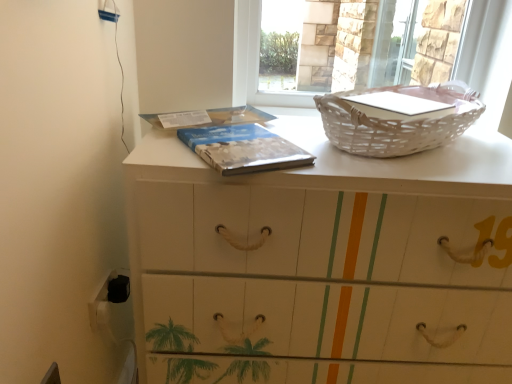
Question: Considering the relative sizes of white wicker basket at upper right and blue textured book at center in the image provided, is white wicker basket at upper right wider than blue textured book at center?

Choices:
 (A) no
 (B) yes

Answer: (A)

Question: From a real-world perspective, is white wicker basket at upper right beneath blue textured book at center?

Choices:
 (A) yes
 (B) no

Answer: (B)

Question: Is white wicker basket at upper right at the right side of blue textured book at center?

Choices:
 (A) yes
 (B) no

Answer: (A)

Question: Is white wicker basket at upper right shorter than blue textured book at center?

Choices:
 (A) yes
 (B) no

Answer: (B)

Question: Is white wicker basket at upper right bigger than blue textured book at center?

Choices:
 (A) yes
 (B) no

Answer: (A)

Question: Considering the relative positions of white wicker basket at upper right and blue textured book at center in the image provided, is white wicker basket at upper right to the left of blue textured book at center from the viewer's perspective?

Choices:
 (A) no
 (B) yes

Answer: (A)

Question: Considering the relative sizes of white wicker basket at upper right and white wicker basket at upper right in the image provided, is white wicker basket at upper right taller than white wicker basket at upper right?

Choices:
 (A) yes
 (B) no

Answer: (A)

Question: Considering the relative sizes of white wicker basket at upper right and white wicker basket at upper right in the image provided, is white wicker basket at upper right smaller than white wicker basket at upper right?

Choices:
 (A) yes
 (B) no

Answer: (B)

Question: Does white wicker basket at upper right lie in front of white wicker basket at upper right?

Choices:
 (A) no
 (B) yes

Answer: (A)

Question: From a real-world perspective, is white wicker basket at upper right positioned over white wicker basket at upper right based on gravity?

Choices:
 (A) yes
 (B) no

Answer: (A)

Question: Can we say white wicker basket at upper right lies outside white wicker basket at upper right?

Choices:
 (A) no
 (B) yes

Answer: (B)

Question: Does white wicker basket at upper right have a lesser height compared to white wicker basket at upper right?

Choices:
 (A) yes
 (B) no

Answer: (B)

Question: Is white wicker basket at upper right completely or partially outside of blue textured book at center?

Choices:
 (A) no
 (B) yes

Answer: (B)